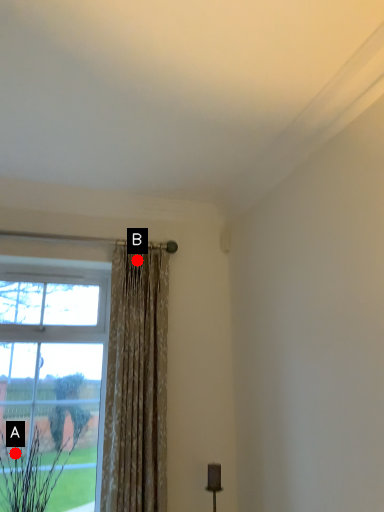
Question: Two points are circled on the image, labeled by A and B beside each circle. Among these points, which one is nearest to the camera?

Choices:
 (A) A is closer
 (B) B is closer

Answer: (A)